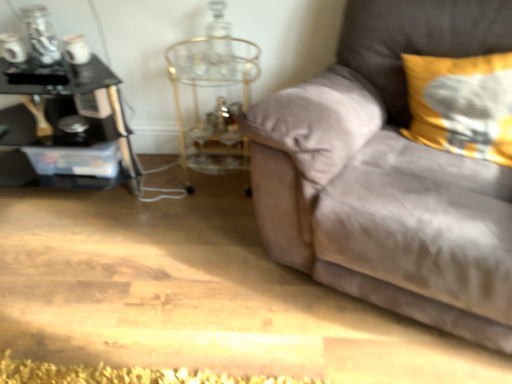
Question: Considering the positions of yellow fabric pillow at upper right and black glass table at left in the image, is yellow fabric pillow at upper right taller or shorter than black glass table at left?

Choices:
 (A) short
 (B) tall

Answer: (A)

Question: From a real-world perspective, is yellow fabric pillow at upper right physically located above or below black glass table at left?

Choices:
 (A) above
 (B) below

Answer: (A)

Question: Based on their relative distances, which object is farther from the gold metallic side table at center?

Choices:
 (A) suede couch at right
 (B) black glass table at left
 (C) yellow fabric pillow at upper right

Answer: (C)

Question: Which is farther from the suede couch at right?

Choices:
 (A) black glass table at left
 (B) yellow fabric pillow at upper right
 (C) gold metallic side table at center

Answer: (A)